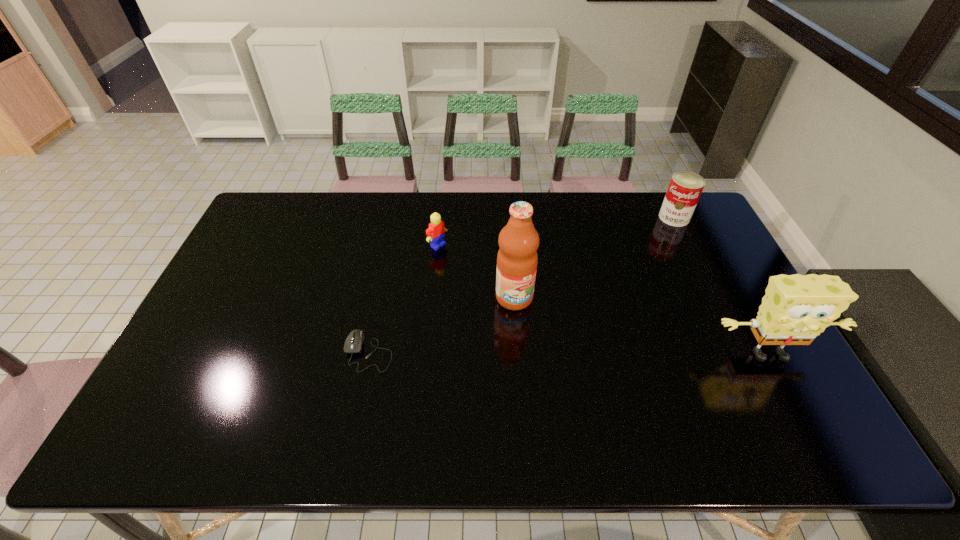
This screenshot has height=540, width=960. In order to click on free spot on the desktop that is between the shortest object and the second tallest object and is positioned on the front label of the third shortest object in this screenshot , I will do `click(590, 353)`.

Identify the location of free spot on the desktop that is between the leftmost object and the fourth shortest object and is positioned on the front-facing side of the fourth nearest object. (589, 353).

You are a GUI agent. You are given a task and a screenshot of the screen. Output one action in this format:
    pyautogui.click(x=<x>, y=<y>)
    Task: Click on the vacant space on the desktop that is between the shortest object and the sponge and is positioned on the front label of the third object from left to right
    The height and width of the screenshot is (540, 960).
    Given the screenshot: What is the action you would take?
    pyautogui.click(x=548, y=353)